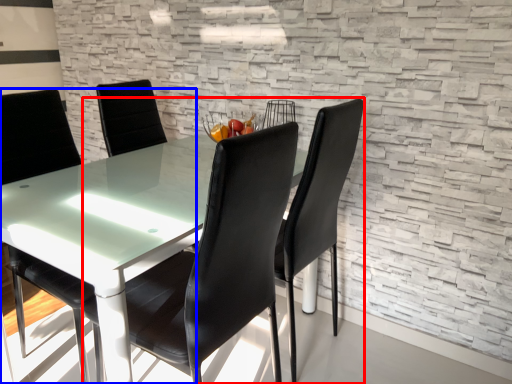
Question: Which object is further to the camera taking this photo, chair (highlighted by a red box) or chair (highlighted by a blue box)?

Choices:
 (A) chair
 (B) chair

Answer: (B)